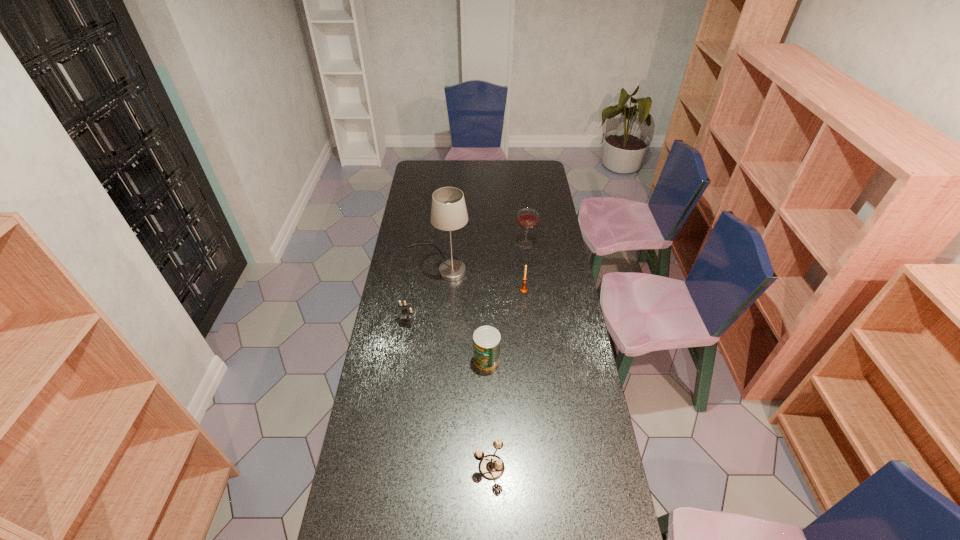
Identify the location of table lamp. (448, 211).

Where is `wineglass`? The image size is (960, 540). wineglass is located at coordinates (527, 219).

Identify the location of the rightmost candle holder. point(523,289).

Where is `the third farthest object`? Image resolution: width=960 pixels, height=540 pixels. the third farthest object is located at coordinates (x=523, y=289).

Locate an element on the screen. The height and width of the screenshot is (540, 960). the second nearest object is located at coordinates (486, 340).

Find the location of `the leftmost candle holder`. the leftmost candle holder is located at coordinates (406, 311).

Locate an element on the screen. the second nearest candle holder is located at coordinates (406, 311).

This screenshot has height=540, width=960. In order to click on the nearest object in this screenshot , I will do [491, 467].

Locate an element on the screen. This screenshot has width=960, height=540. the nearest candle holder is located at coordinates (491, 467).

At what (x,y) coordinates should I click in order to perform the action: click on vacant space situated 0.230m on the right of the table lamp. Please return your answer as a coordinate pair (x, y). This screenshot has height=540, width=960. Looking at the image, I should click on (519, 264).